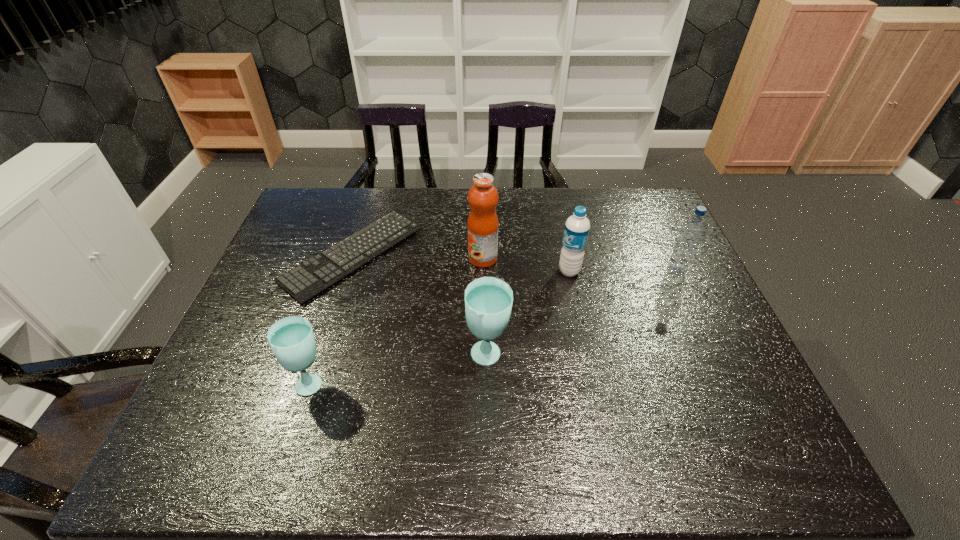
Locate an element on the screen. The image size is (960, 540). vacant space that satisfies the following two spatial constraints: 1. on the label of the second object from right to left; 2. on the front side of the shorter glass is located at coordinates (592, 382).

The width and height of the screenshot is (960, 540). Identify the location of free location that satisfies the following two spatial constraints: 1. on the front label of the right water bottle; 2. on the right side of the tallest object. (483, 271).

Where is `vacant point that satisfies the following two spatial constraints: 1. on the back side of the right water bottle; 2. on the front label of the tallest object`? This screenshot has width=960, height=540. vacant point that satisfies the following two spatial constraints: 1. on the back side of the right water bottle; 2. on the front label of the tallest object is located at coordinates (670, 259).